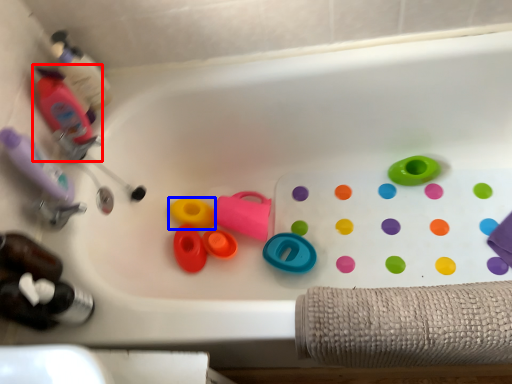
Question: Which point is further to the camera, bottle (highlighted by a red box) or toy (highlighted by a blue box)?

Choices:
 (A) bottle
 (B) toy

Answer: (B)